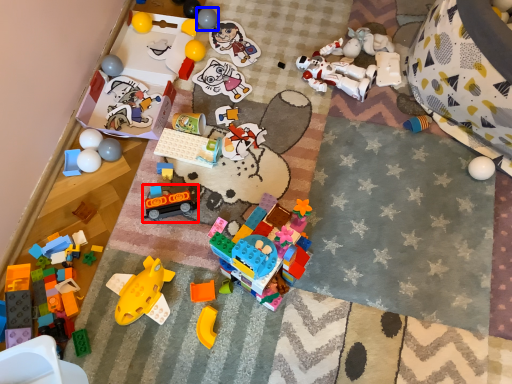
Question: Which object is further to the camera taking this photo, toy (highlighted by a red box) or toy (highlighted by a blue box)?

Choices:
 (A) toy
 (B) toy

Answer: (B)